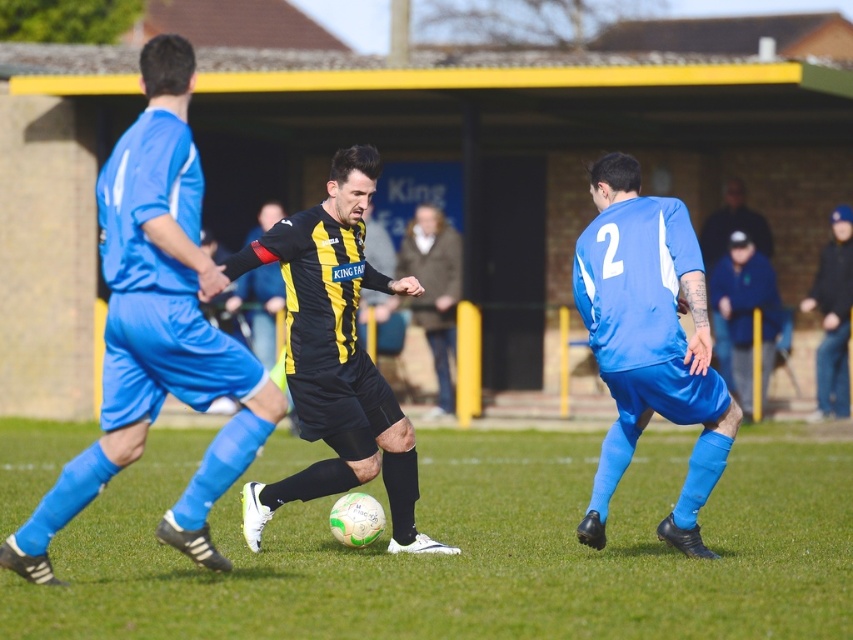
Question: Which object appears closest to the camera in this image?

Choices:
 (A) blue fabric jacket at right
 (B) black matte jersey at center
 (C) blue matte jersey at right

Answer: (B)

Question: Which is farther from the green grass at center?

Choices:
 (A) blue matte jersey at right
 (B) yellow and black jersey at center
 (C) blue fabric jacket at right
 (D) black/yellow striped jersey at center

Answer: (B)

Question: Which point is farther to the camera?

Choices:
 (A) blue matte jersey at right
 (B) blue fabric jacket at right
 (C) yellow and black jersey at center

Answer: (C)

Question: Can you confirm if black matte jersey at center is thinner than black/yellow striped jersey at center?

Choices:
 (A) yes
 (B) no

Answer: (B)

Question: Does black matte jersey at center appear over blue matte jersey at right?

Choices:
 (A) no
 (B) yes

Answer: (B)

Question: Does blue matte jersey at right have a greater width compared to dark blue jeans at right?

Choices:
 (A) yes
 (B) no

Answer: (A)